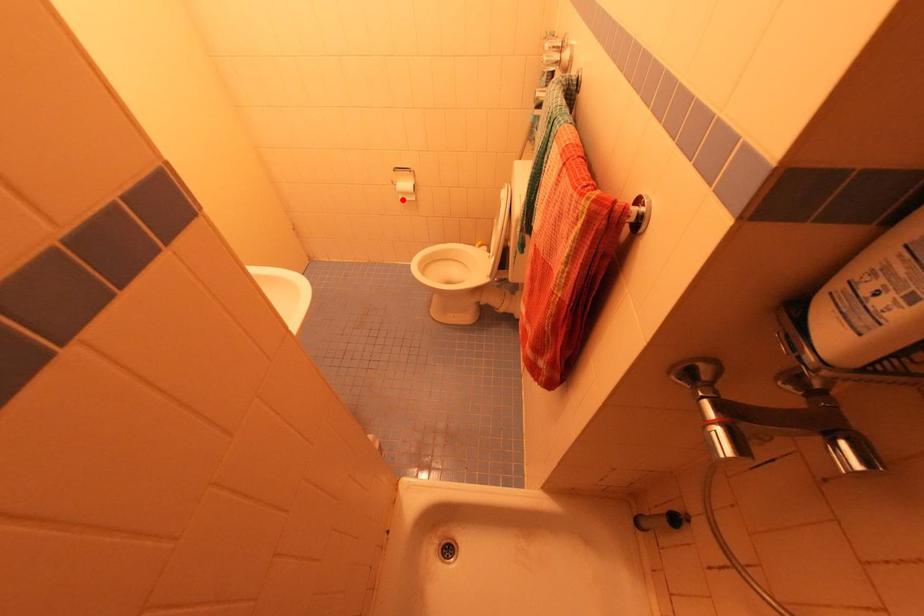
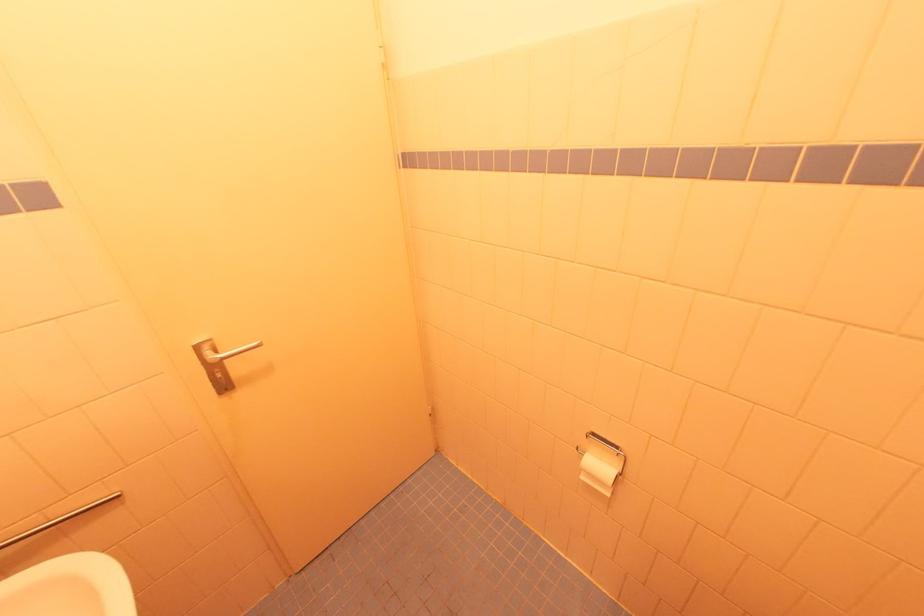
Question: I am providing you with two images of the same scene from different viewpoints. Given a red point in image1, look at the same physical point in image2. Is it:

Choices:
 (A) Closer to the viewpoint
 (B) Farther from the viewpoint

Answer: (B)